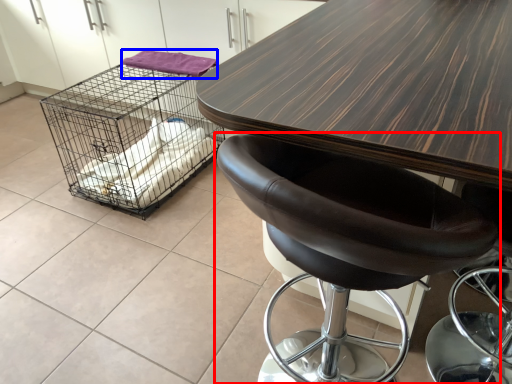
Question: Which object is further to the camera taking this photo, chair (highlighted by a red box) or material (highlighted by a blue box)?

Choices:
 (A) chair
 (B) material

Answer: (B)